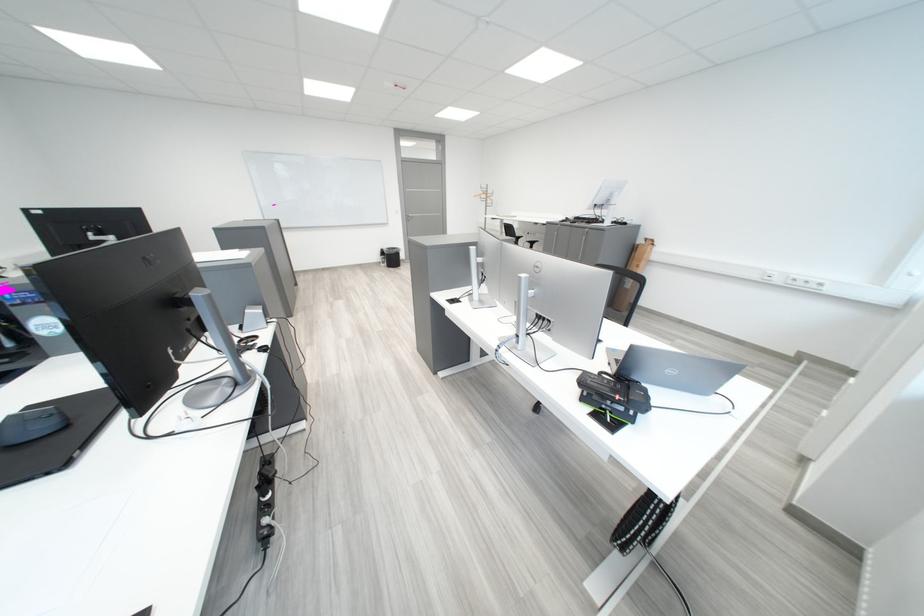
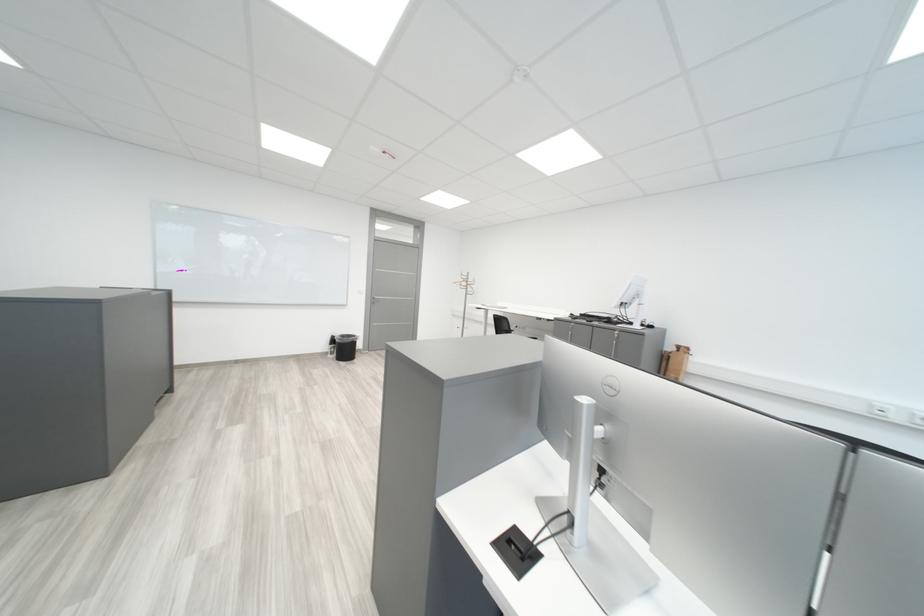
Locate, in the second image, the point that corresponds to (791,282) in the first image.

(910, 419)